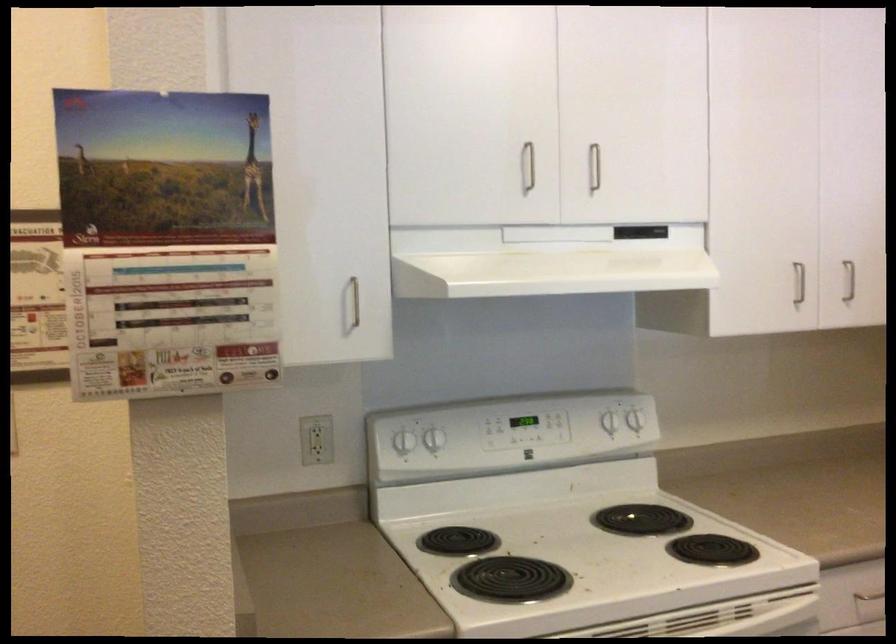
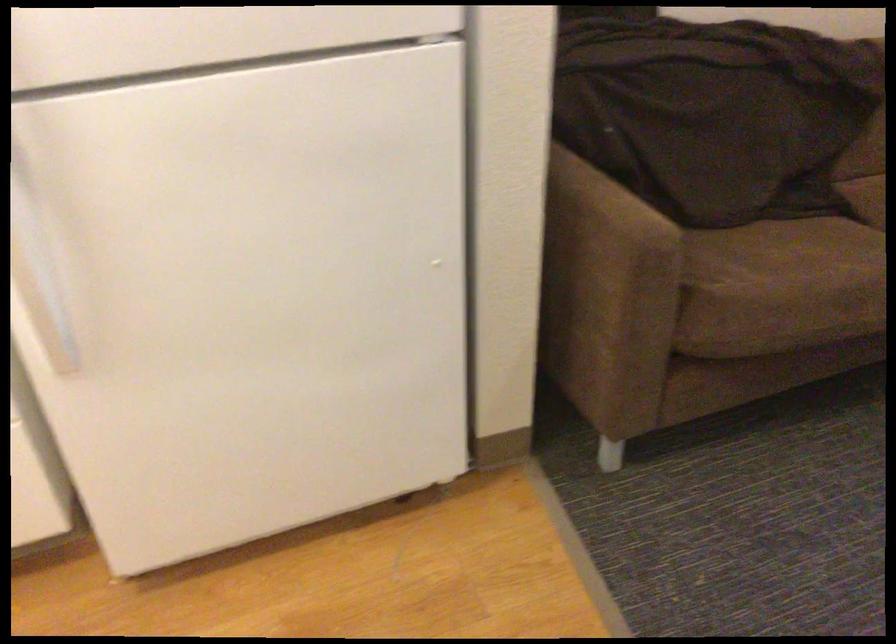
How did the camera likely rotate?

The camera rotated toward right-down.